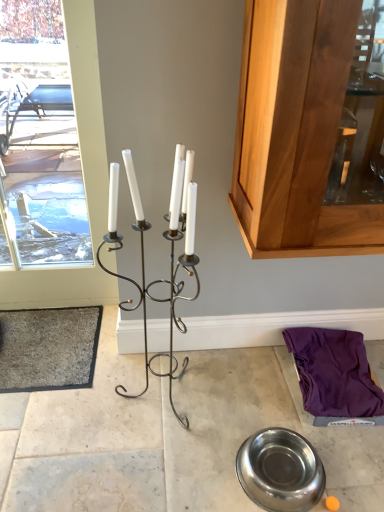
Where is `vacant space in front of black wrought iron candle holder at center`? The width and height of the screenshot is (384, 512). vacant space in front of black wrought iron candle holder at center is located at coordinates (145, 467).